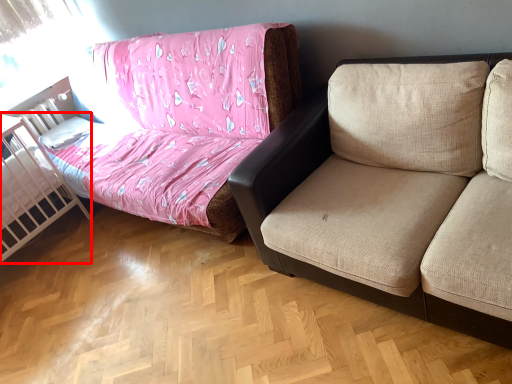
Question: From the image's perspective, what is the correct spatial positioning of infant bed (annotated by the red box) in reference to studio couch?

Choices:
 (A) above
 (B) below

Answer: (B)